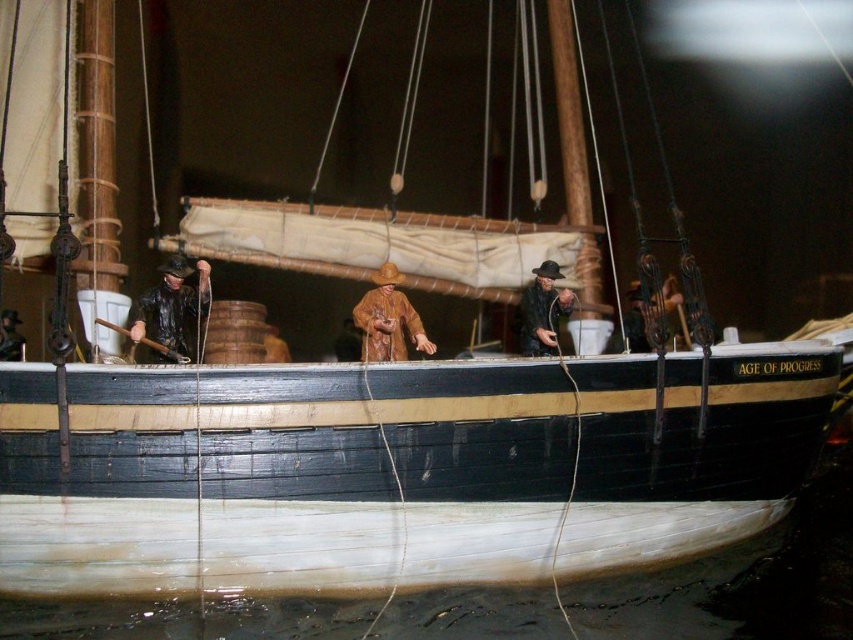
Question: Which object is farther from the camera taking this photo?

Choices:
 (A) matte black coat at left
 (B) brown matte figure at center

Answer: (B)

Question: Which object appears farthest from the camera in this image?

Choices:
 (A) matte black coat at left
 (B) brown matte figure at center
 (C) brown leather coat at center

Answer: (C)

Question: Considering the relative positions of matte brown leather hat at center and brown leather coat at center in the image provided, where is matte brown leather hat at center located with respect to brown leather coat at center?

Choices:
 (A) left
 (B) right

Answer: (B)

Question: Among these points, which one is nearest to the camera?

Choices:
 (A) (413, 310)
 (B) (178, 326)

Answer: (B)

Question: Does matte brown leather hat at center appear on the right side of brown leather coat at center?

Choices:
 (A) no
 (B) yes

Answer: (B)

Question: Is matte black coat at left below matte brown leather hat at center?

Choices:
 (A) no
 (B) yes

Answer: (B)